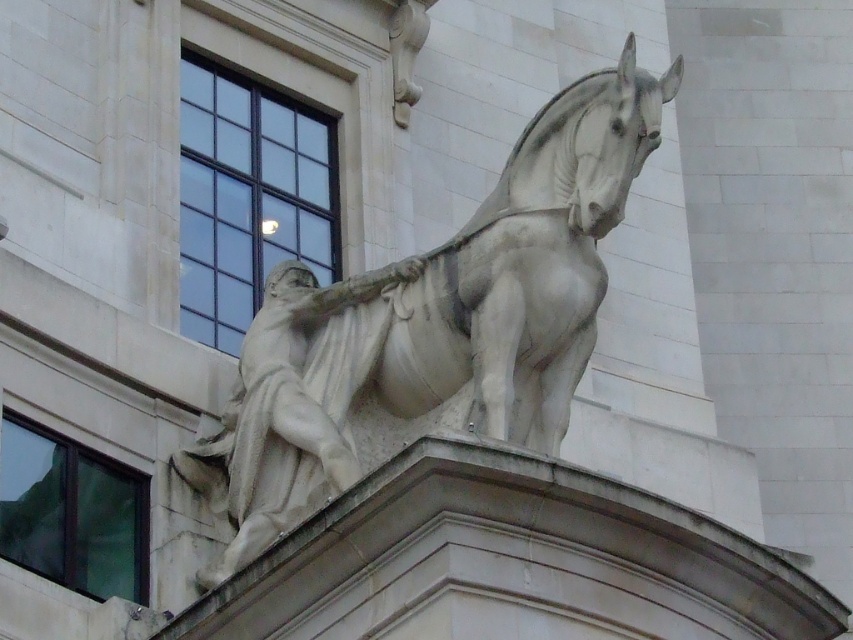
You are standing at the base of the building where the sculpture is mounted. You want to take a photo of the white marble horse at upper center without any obstructions. Considering your current position, is the horse within your camera lens range if your camera has a maximum focus range of 50 meters?

The white marble horse at upper center is 52.57 meters away from viewer. Since the camera can only focus up to 50 meters, the horse is slightly out of range and may appear blurry or out of focus.

You are an art conservator assessing the placement of the white marble horse at upper center and the white marble statue at upper center on the building corner. Given that the recommended minimum distance between two sculptures for preservation purposes is 1.5 meters, is the current spacing sufficient?

The white marble horse at upper center is 1.37 meters from the white marble statue at upper center, which is below the recommended 1.5 meters. Therefore, the current spacing is insufficient for preservation purposes.